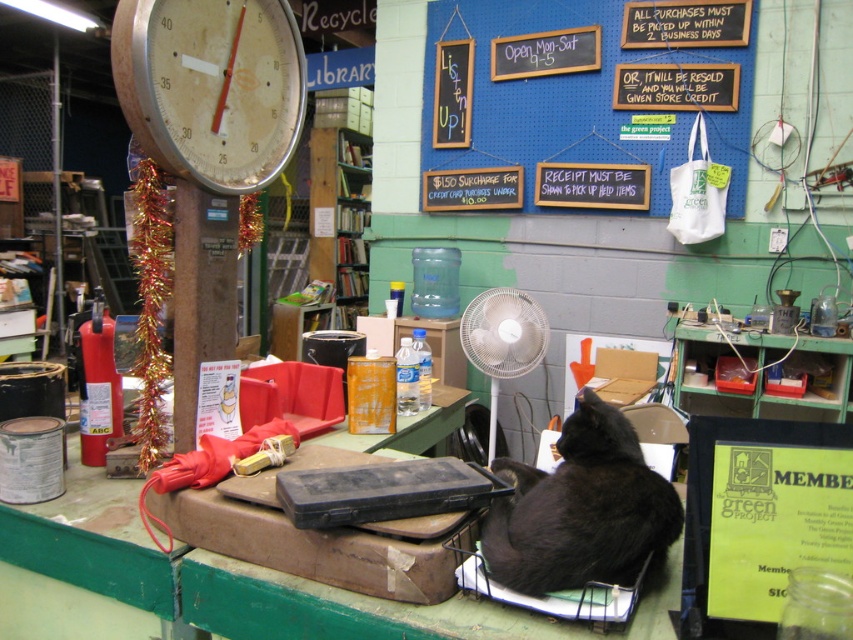
Who is lower down, blue pegboard at upper center or black fur cat at lower right?

black fur cat at lower right is below.

I want to click on blue pegboard at upper center, so click(576, 99).

You are a GUI agent. You are given a task and a screenshot of the screen. Output one action in this format:
    pyautogui.click(x=<x>, y=<y>)
    Task: Click on the blue pegboard at upper center
    This screenshot has height=640, width=853.
    Given the screenshot: What is the action you would take?
    pyautogui.click(x=576, y=99)

From the picture: Does dirty white scale at upper left appear on the right side of black fur cat at lower right?

Incorrect, dirty white scale at upper left is not on the right side of black fur cat at lower right.

Is point (259, 45) farther from viewer compared to point (512, 509)?

Yes, it is.

The image size is (853, 640). What are the coordinates of `dirty white scale at upper left` in the screenshot? It's located at (212, 86).

Based on the photo, who is positioned more to the right, blue pegboard at upper center or dirty white scale at upper left?

Positioned to the right is blue pegboard at upper center.

Is blue pegboard at upper center above dirty white scale at upper left?

Yes.

Does point (485, 120) lie behind point (277, 17)?

Yes, it is behind point (277, 17).

Identify the location of blue pegboard at upper center. The width and height of the screenshot is (853, 640). (576, 99).